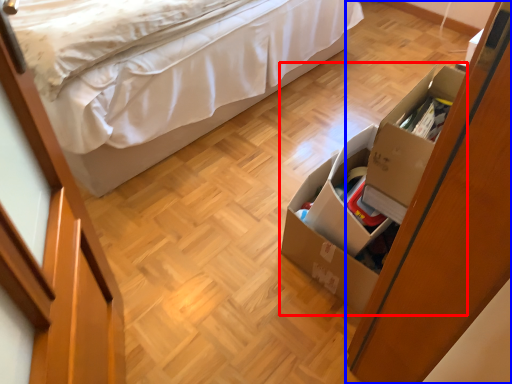
Question: Which object appears farthest to the camera in this image, storage box (highlighted by a red box) or dresser (highlighted by a blue box)?

Choices:
 (A) storage box
 (B) dresser

Answer: (A)